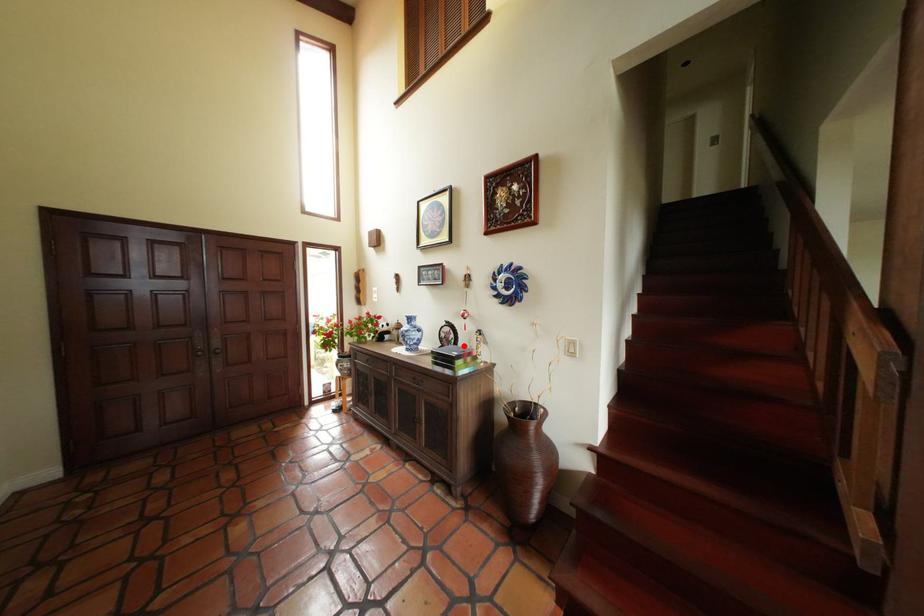
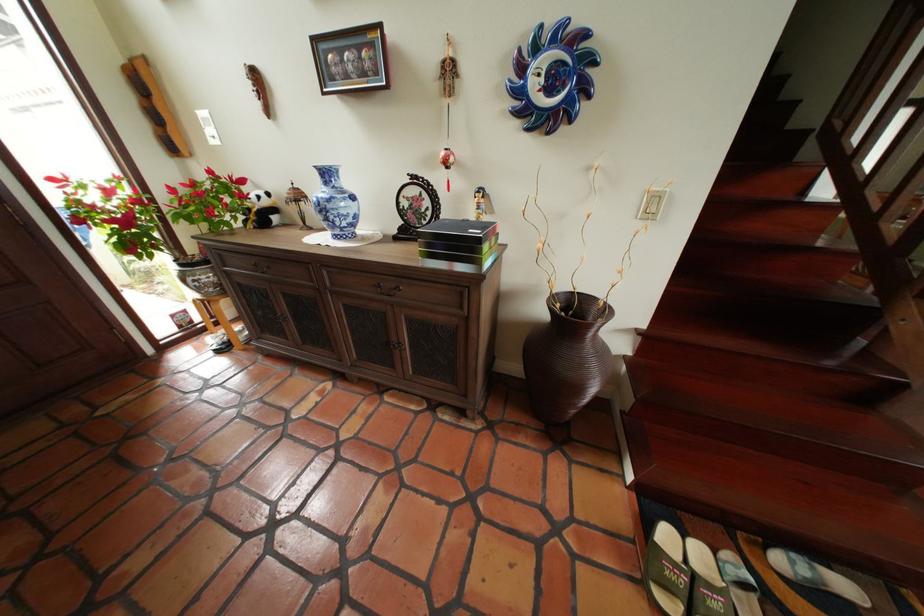
Question: I am providing you with two images of the same scene from different viewpoints. Given a red point in image1, look at the same physical point in image2. Is it:

Choices:
 (A) Closer to the viewpoint
 (B) Farther from the viewpoint

Answer: (A)